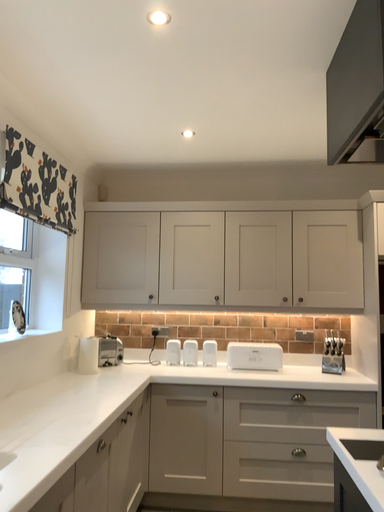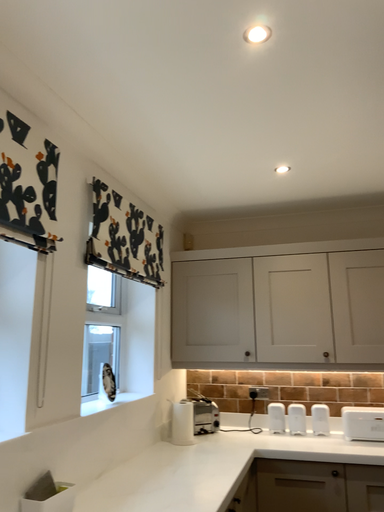
Question: Which way did the camera rotate in the video?

Choices:
 (A) rotated left
 (B) rotated right

Answer: (A)